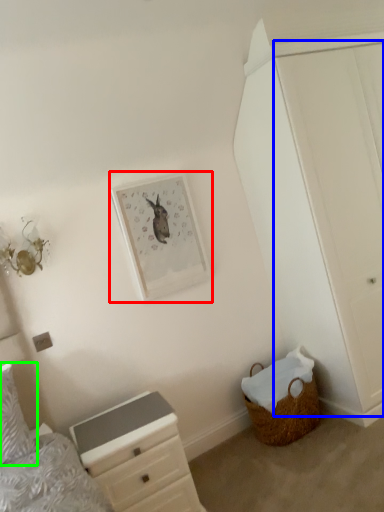
Question: Which object is the farthest from picture frame (highlighted by a red box)? Choose among these: door (highlighted by a blue box) or pillow (highlighted by a green box).

Choices:
 (A) door
 (B) pillow

Answer: (B)